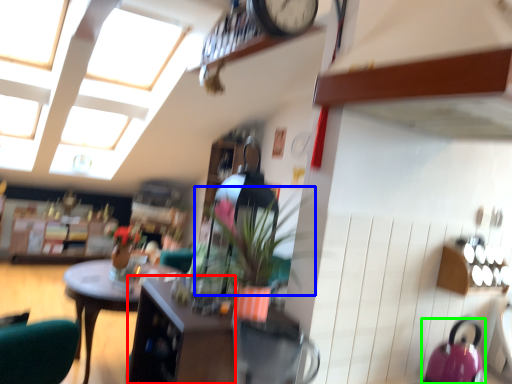
Question: Based on their relative distances, which object is farther from cabinetry (highlighted by a red box)? Choose from plant (highlighted by a blue box) and kettle (highlighted by a green box).

Choices:
 (A) plant
 (B) kettle

Answer: (B)